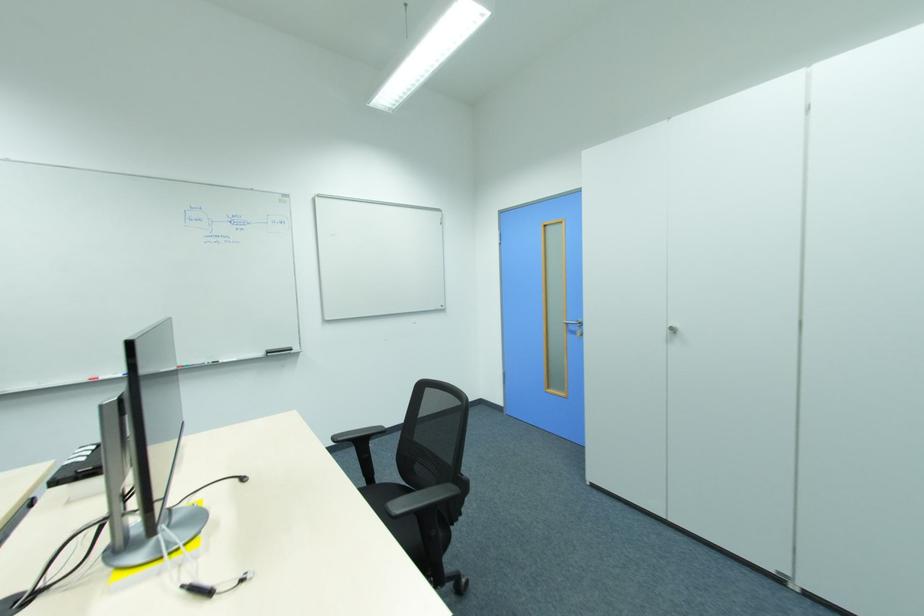
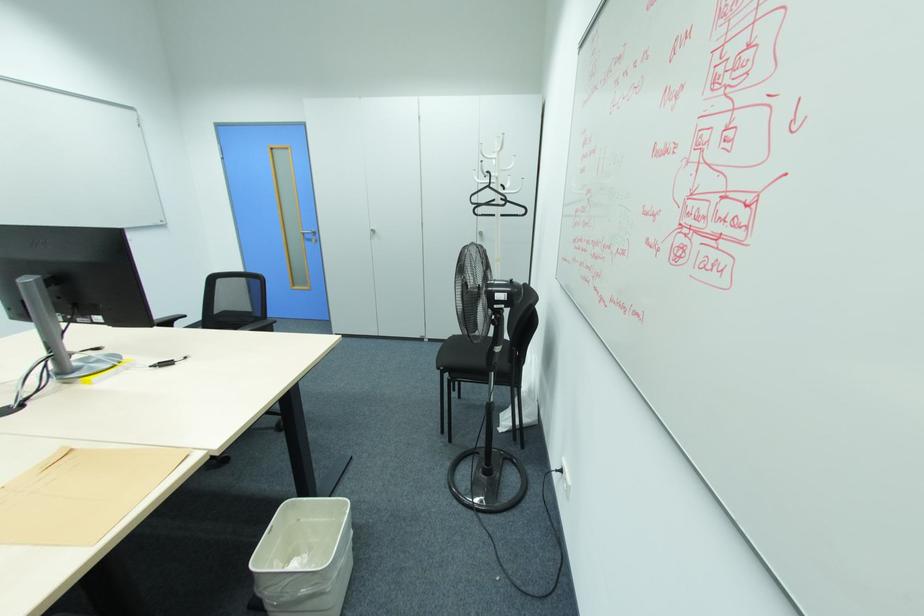
The point at [581,323] is marked in the first image. Where is the corresponding point in the second image?

(314, 233)